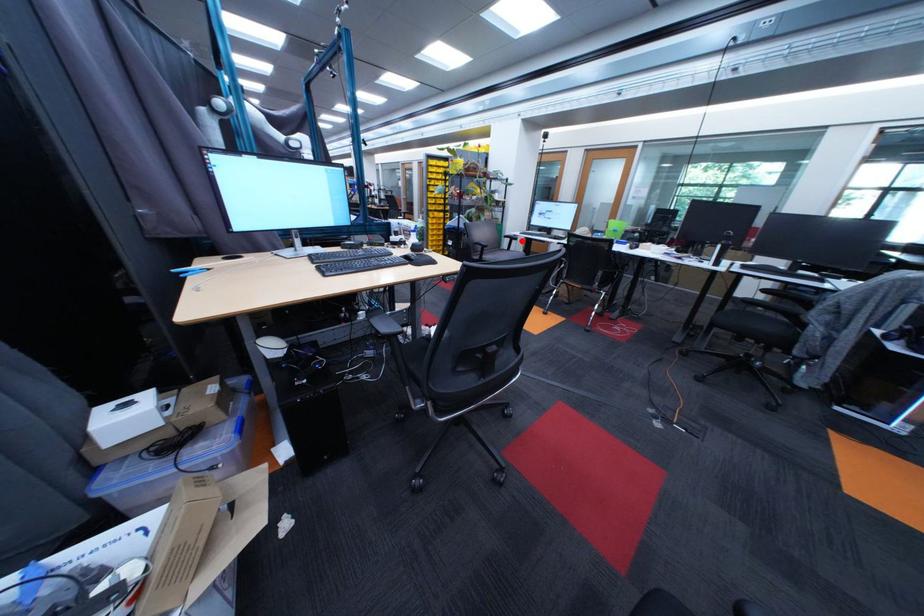
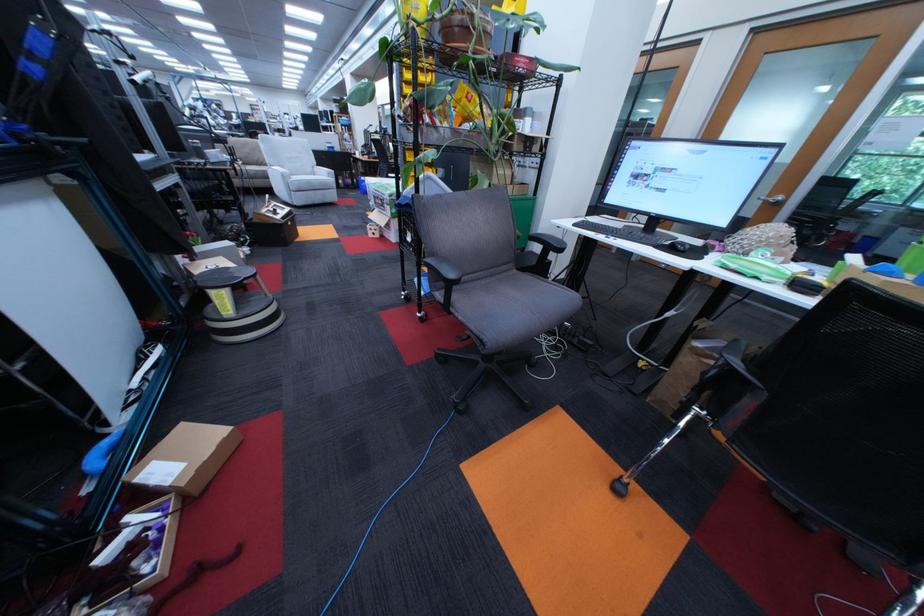
Question: I am providing you with two images of the same scene from different viewpoints. Given a red point in image1, look at the same physical point in image2. Is it:

Choices:
 (A) Closer to the viewpoint
 (B) Farther from the viewpoint

Answer: (B)